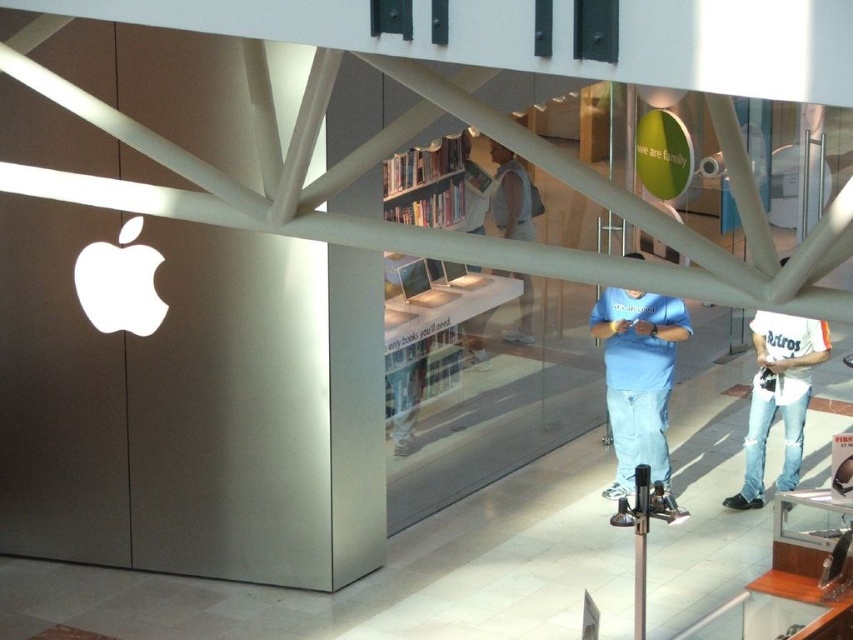
Is light blue t-shirt at center thinner than white cotton shirt at lower right?

Yes.

Is light blue t-shirt at center shorter than white cotton shirt at lower right?

No, light blue t-shirt at center is not shorter than white cotton shirt at lower right.

Who is more forward, (605, 397) or (795, 413)?

Point (795, 413)

Where is `light blue t-shirt at center`? The image size is (853, 640). light blue t-shirt at center is located at coordinates (637, 378).